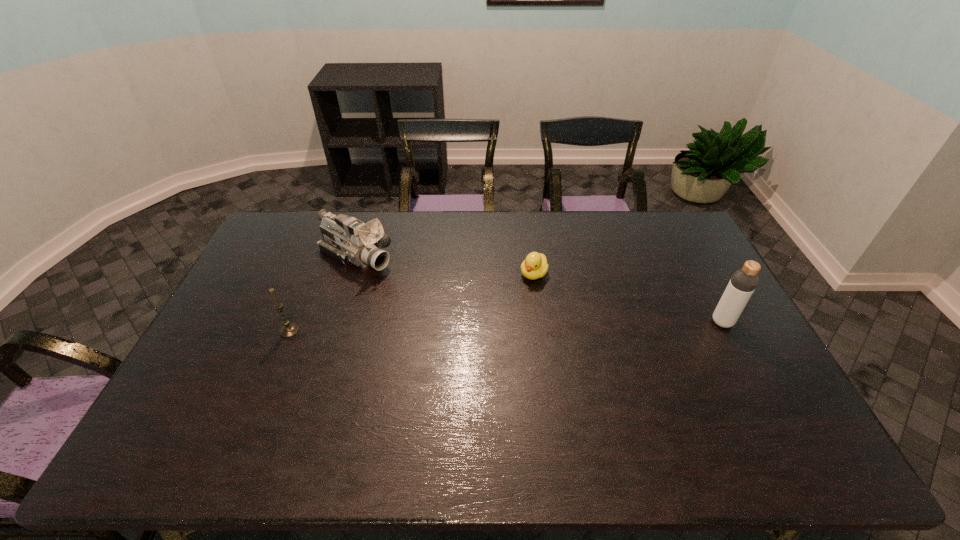
Locate an element on the screen. The image size is (960, 540). vacant region located on the beak of the duckling is located at coordinates (516, 300).

Identify the location of vacant space located 0.310m on the front-facing side of the camcorder. (454, 310).

This screenshot has height=540, width=960. What are the coordinates of `vacant area located 0.140m on the front-facing side of the camcorder` in the screenshot? It's located at coord(415,287).

Image resolution: width=960 pixels, height=540 pixels. Identify the location of vacant space located on the front-facing side of the camcorder. coord(438,301).

I want to click on object situated at the far edge, so click(348, 240).

Where is `object located at the right edge`? object located at the right edge is located at coordinates (744, 281).

Identify the location of free space at the far edge of the desktop. Image resolution: width=960 pixels, height=540 pixels. (517, 225).

This screenshot has height=540, width=960. I want to click on vacant space at the near edge of the desktop, so click(x=512, y=413).

In the image, there is a desktop. Where is `free space at the right edge`? The width and height of the screenshot is (960, 540). free space at the right edge is located at coordinates (662, 251).

At what (x,y) coordinates should I click in order to perform the action: click on vacant space at the far left corner. Please return your answer as a coordinate pair (x, y). The width and height of the screenshot is (960, 540). Looking at the image, I should click on (278, 226).